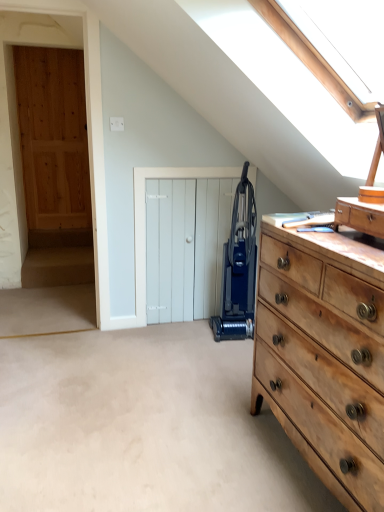
Question: Does blue plastic vacuum cleaner at center contain white wooden door at center?

Choices:
 (A) yes
 (B) no

Answer: (B)

Question: Considering the relative sizes of blue plastic vacuum cleaner at center and white wooden door at center in the image provided, is blue plastic vacuum cleaner at center taller than white wooden door at center?

Choices:
 (A) no
 (B) yes

Answer: (B)

Question: Is blue plastic vacuum cleaner at center bigger than white wooden door at center?

Choices:
 (A) yes
 (B) no

Answer: (A)

Question: From a real-world perspective, does blue plastic vacuum cleaner at center sit lower than white wooden door at center?

Choices:
 (A) yes
 (B) no

Answer: (B)

Question: Is blue plastic vacuum cleaner at center further to camera compared to white wooden door at center?

Choices:
 (A) no
 (B) yes

Answer: (A)

Question: Is blue plastic vacuum cleaner at center shorter than white wooden door at center?

Choices:
 (A) no
 (B) yes

Answer: (A)

Question: Is blue plastic vacuum cleaner at center next to wooden drawer at right?

Choices:
 (A) yes
 (B) no

Answer: (B)

Question: Considering the relative sizes of blue plastic vacuum cleaner at center and wooden drawer at right in the image provided, is blue plastic vacuum cleaner at center bigger than wooden drawer at right?

Choices:
 (A) yes
 (B) no

Answer: (A)

Question: Is wooden drawer at right completely or partially inside blue plastic vacuum cleaner at center?

Choices:
 (A) no
 (B) yes

Answer: (A)

Question: Considering the relative sizes of blue plastic vacuum cleaner at center and wooden drawer at right in the image provided, is blue plastic vacuum cleaner at center wider than wooden drawer at right?

Choices:
 (A) no
 (B) yes

Answer: (B)

Question: From the image's perspective, is blue plastic vacuum cleaner at center beneath wooden drawer at right?

Choices:
 (A) yes
 (B) no

Answer: (A)

Question: From the image's perspective, is blue plastic vacuum cleaner at center above wooden drawer at right?

Choices:
 (A) yes
 (B) no

Answer: (B)

Question: Considering the relative sizes of natural wood dresser at right and blue plastic vacuum cleaner at center in the image provided, is natural wood dresser at right smaller than blue plastic vacuum cleaner at center?

Choices:
 (A) no
 (B) yes

Answer: (A)